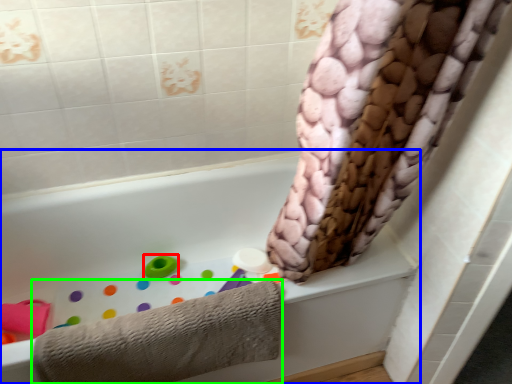
Question: Which object is the closest to the toy (highlighted by a red box)? Choose among these: bathtub (highlighted by a blue box) or towel (highlighted by a green box).

Choices:
 (A) bathtub
 (B) towel

Answer: (A)